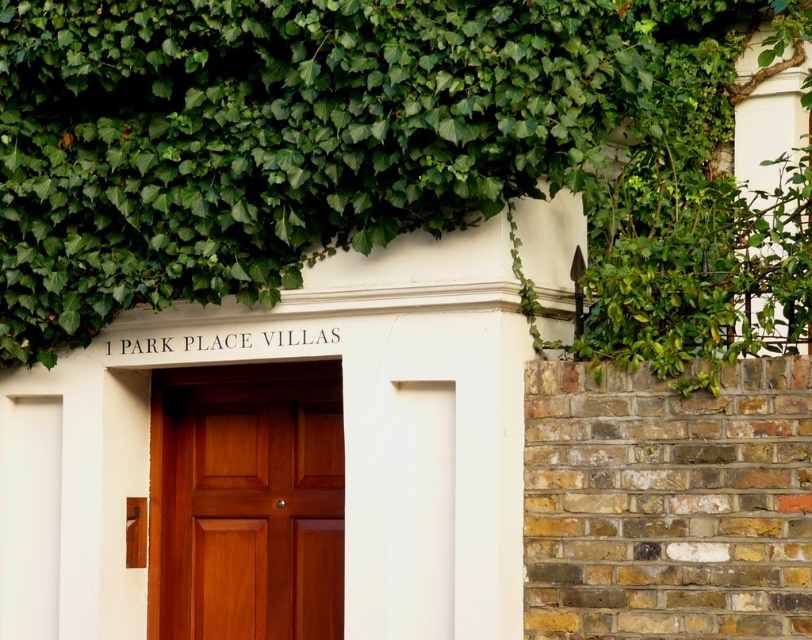
Which is behind, point (532, 180) or point (318, 529)?

Point (318, 529)

Find the location of a particular element. green leafy ivy at upper center is located at coordinates (318, 132).